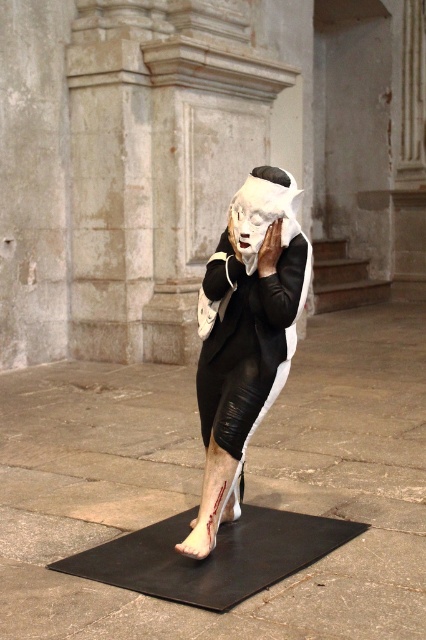
You are an art conservator examining the sculpture from a viewer perspective. You notice two points marked on the sculpture. The first point is at coordinates point (278, 324) and the second is at point (279, 218). Which of these points is closer to you?

Point (278, 324) is in front of point (279, 218), so it is closer to you.

You are an art curator planning to move the black leather robe at center and the matte black dress at center to a new exhibition space. The new space has limited depth. If you want to preserve the original spatial relationship between the two objects, which object should you place closer to the front?

The matte black dress at center should be placed closer to the front since the black leather robe at center is behind it in the original arrangement.

Consider the image. You are an art conservator standing 3 meters away from the sculpture. You need to examine the black leather robe at center closely. Can you reach it without moving closer?

The black leather robe at center is 3.43 meters away from the viewer. Since you are standing 3 meters away, you are still 0.43 meters away from it, so you need to move closer to examine it properly.